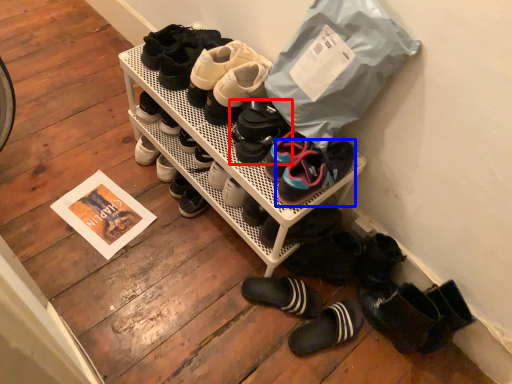
Question: Which object appears farthest to the camera in this image, footwear (highlighted by a red box) or footwear (highlighted by a blue box)?

Choices:
 (A) footwear
 (B) footwear

Answer: (A)